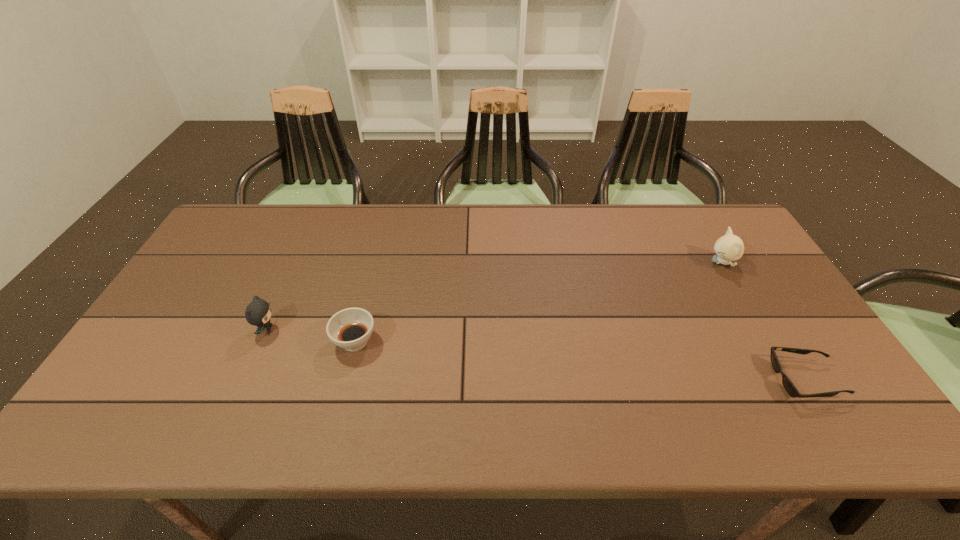
The width and height of the screenshot is (960, 540). Find the location of `free space located on the front-facing side of the left kitten`. free space located on the front-facing side of the left kitten is located at coordinates (382, 329).

Image resolution: width=960 pixels, height=540 pixels. Identify the location of free space located on the back of the third object from right to left. (374, 267).

Where is `free spot located 0.360m on the front-facing side of the shortest object`? This screenshot has height=540, width=960. free spot located 0.360m on the front-facing side of the shortest object is located at coordinates (625, 380).

This screenshot has height=540, width=960. I want to click on vacant space located on the front-facing side of the shortest object, so click(x=634, y=380).

Identify the location of vacant space located on the front-facing side of the shortest object. [x=675, y=380].

Find the location of a particular element. The width and height of the screenshot is (960, 540). object that is at the near edge is located at coordinates (787, 383).

This screenshot has height=540, width=960. I want to click on kitten at the right edge, so click(x=729, y=247).

Locate an element on the screen. This screenshot has height=540, width=960. sunglasses located at the right edge is located at coordinates (787, 383).

Image resolution: width=960 pixels, height=540 pixels. Find the location of `object positioned at the near right corner`. object positioned at the near right corner is located at coordinates (787, 383).

Locate an element on the screen. The height and width of the screenshot is (540, 960). vacant position at the far edge of the desktop is located at coordinates (470, 228).